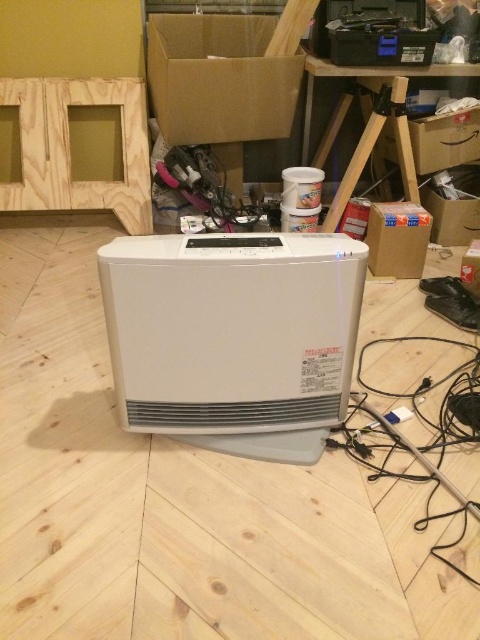
Between brown cardboard box at right and cardboard box at center, which one has more height?

With more height is brown cardboard box at right.

Between point (383, 243) and point (470, 250), which one is positioned behind?

The point (383, 243) is behind.

This screenshot has height=640, width=480. I want to click on brown cardboard box at right, so pos(396,237).

Is white plastic heater at center bigger than black cable at lower right?

No.

Who is positioned more to the left, white plastic heater at center or black cable at lower right?

Positioned to the left is white plastic heater at center.

Between point (324, 278) and point (455, 385), which one is positioned behind?

The point (455, 385) is behind.

Where is `white plastic heater at center`? This screenshot has width=480, height=640. white plastic heater at center is located at coordinates (233, 337).

Can you confirm if white plastic heater at center is shorter than brown cardboard box at upper center?

Indeed, white plastic heater at center has a lesser height compared to brown cardboard box at upper center.

Can you confirm if white plastic heater at center is thinner than brown cardboard box at upper center?

Indeed, white plastic heater at center has a lesser width compared to brown cardboard box at upper center.

Where is `white plastic heater at center`? Image resolution: width=480 pixels, height=640 pixels. white plastic heater at center is located at coordinates 233,337.